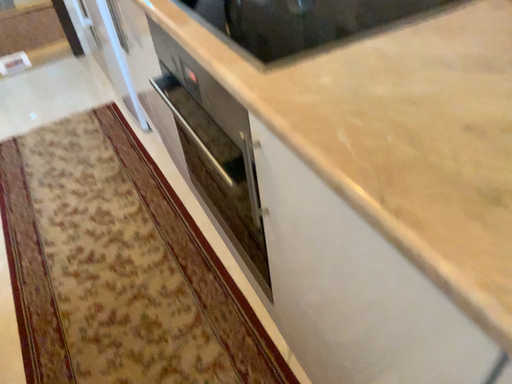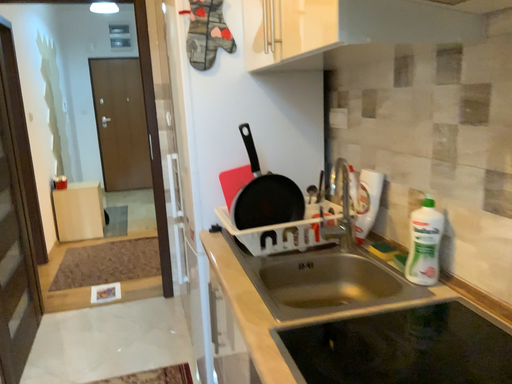
Question: Which way did the camera rotate in the video?

Choices:
 (A) rotated downward
 (B) rotated upward

Answer: (B)